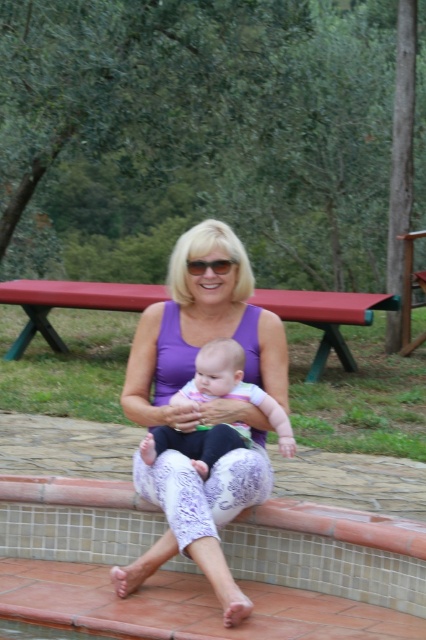
Question: Is purple lace pants at center wider than soft pink fabric baby at center?

Choices:
 (A) yes
 (B) no

Answer: (A)

Question: Among these points, which one is farthest from the camera?

Choices:
 (A) (241, 372)
 (B) (267, 369)

Answer: (B)

Question: Among these points, which one is farthest from the camera?

Choices:
 (A) click(x=198, y=364)
 (B) click(x=2, y=282)

Answer: (B)

Question: Is purple lace pants at center to the left of red painted wood picnic table at center from the viewer's perspective?

Choices:
 (A) no
 (B) yes

Answer: (A)

Question: Considering the real-world distances, which object is closest to the purple lace pants at center?

Choices:
 (A) soft pink fabric baby at center
 (B) red painted wood picnic table at center

Answer: (A)

Question: Can you confirm if purple lace pants at center is thinner than soft pink fabric baby at center?

Choices:
 (A) no
 (B) yes

Answer: (A)